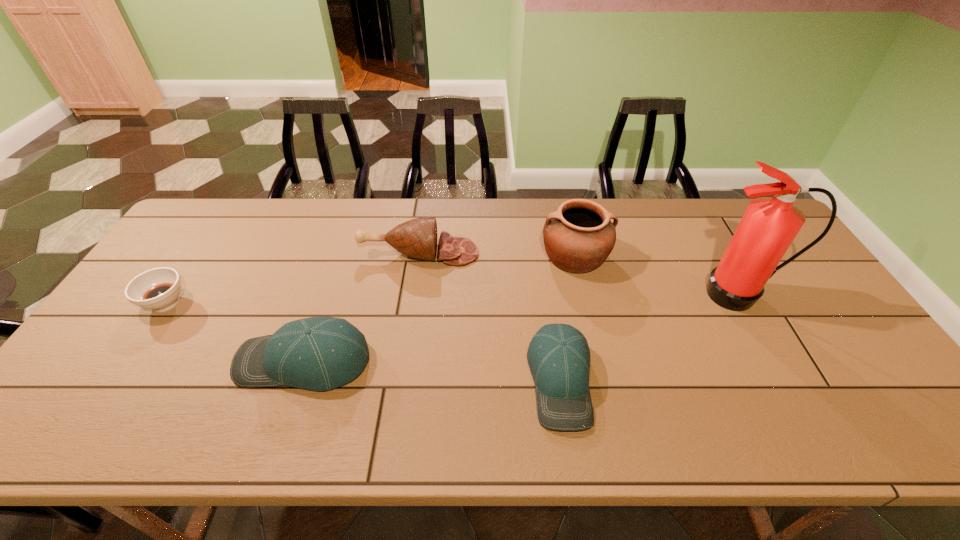
At what (x,y) coordinates should I click in order to perform the action: click on the taller baseball cap. Please return your answer as a coordinate pair (x, y). Looking at the image, I should click on (318, 353).

Where is `the fifth tallest object`? Image resolution: width=960 pixels, height=540 pixels. the fifth tallest object is located at coordinates (559, 359).

Locate an element on the screen. the shorter baseball cap is located at coordinates (559, 359).

Where is `pottery`? pottery is located at coordinates (578, 237).

Where is `the shortest object`? This screenshot has width=960, height=540. the shortest object is located at coordinates (158, 289).

Identify the location of soup bowl. The height and width of the screenshot is (540, 960). (158, 289).

In order to click on ham in this screenshot , I will do (x=417, y=238).

Where is `the tallest object`? This screenshot has height=540, width=960. the tallest object is located at coordinates (769, 225).

In order to click on fire extinguisher in this screenshot , I will do `click(769, 225)`.

I want to click on free space located on the left of the left baseball cap, so click(185, 361).